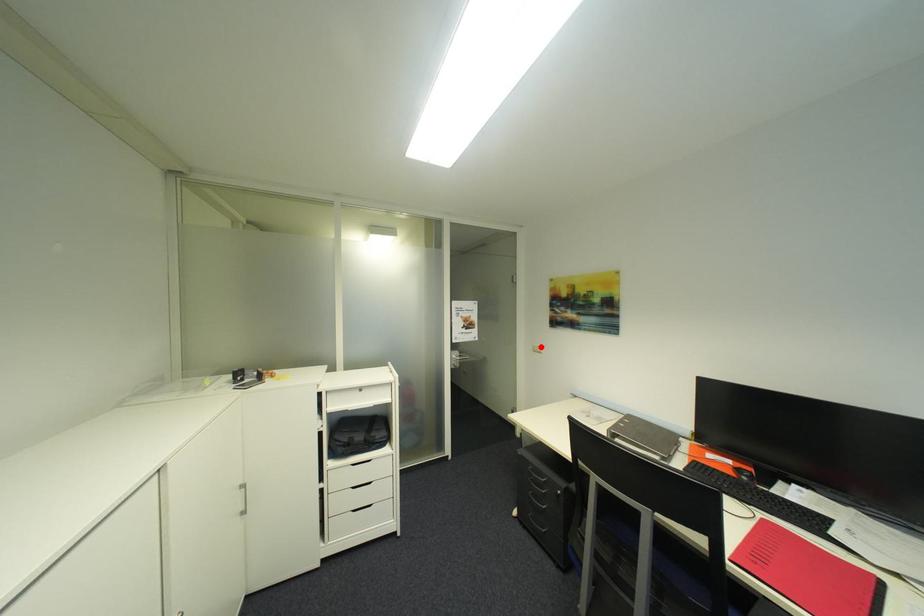
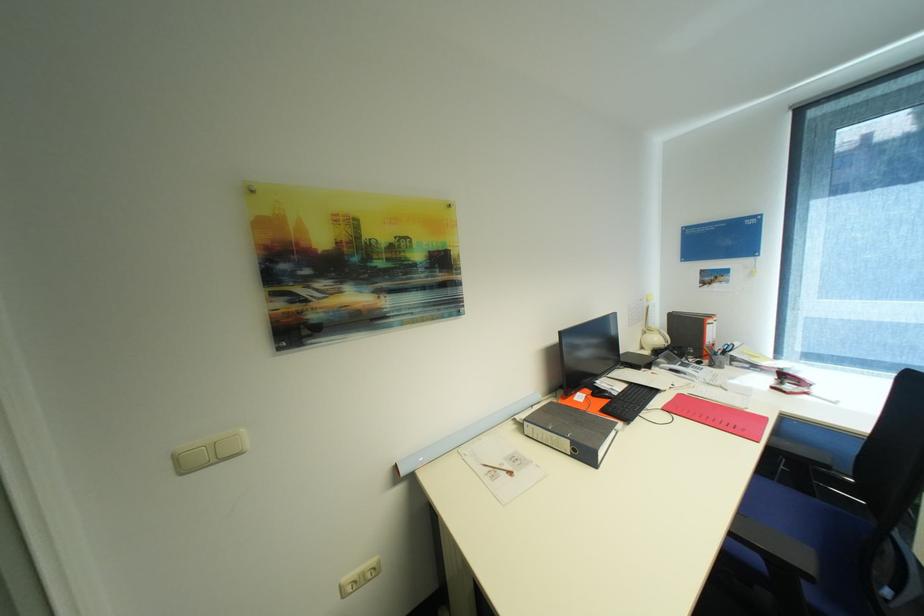
Locate, in the second image, the point that corresponds to the highlighted location in the first image.

(185, 458)